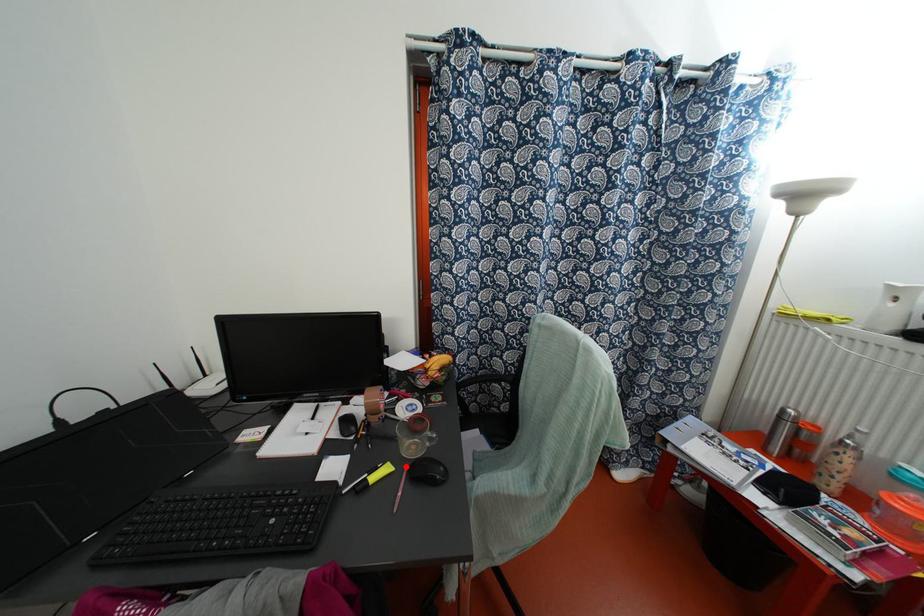
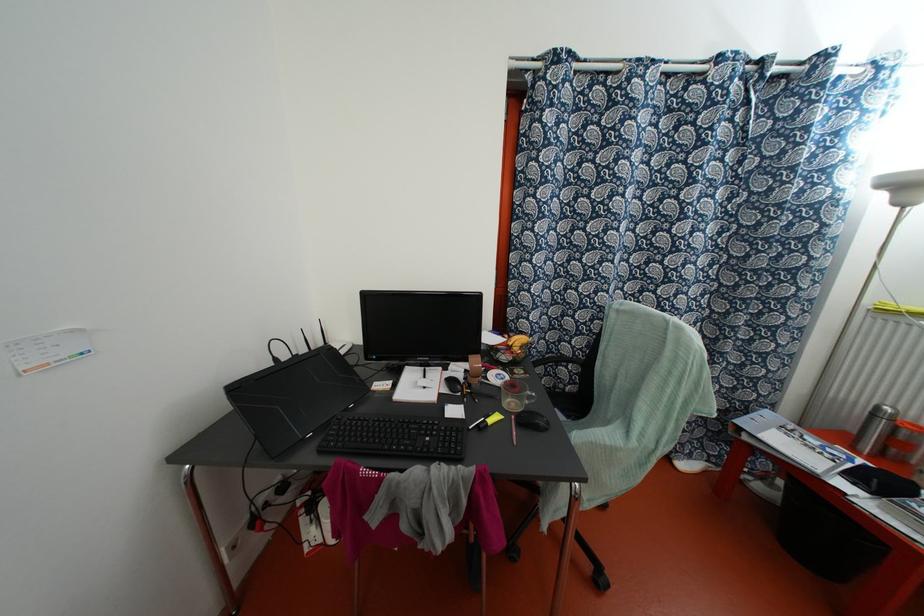
Where in the second image is the point corresponding to the highlighted location from the first image?

(513, 416)